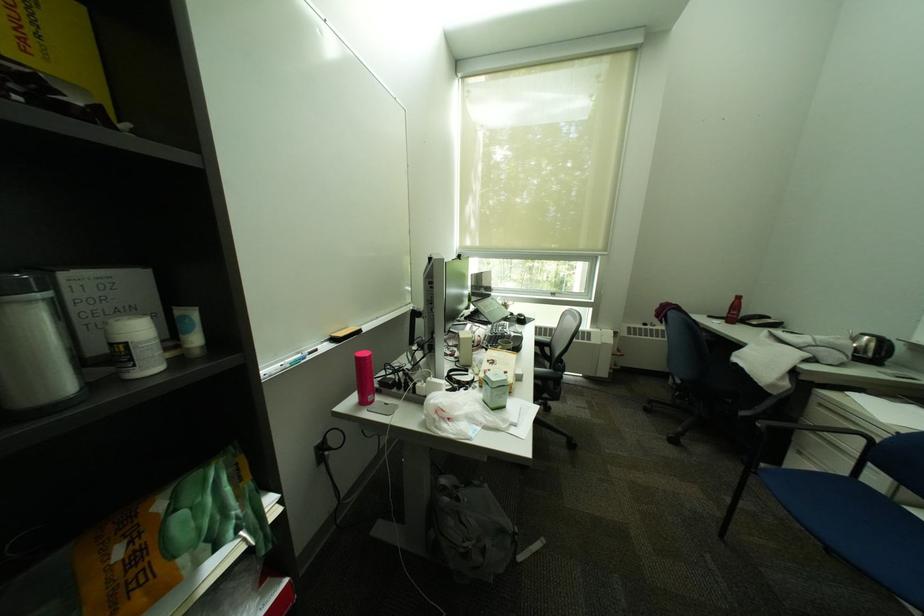
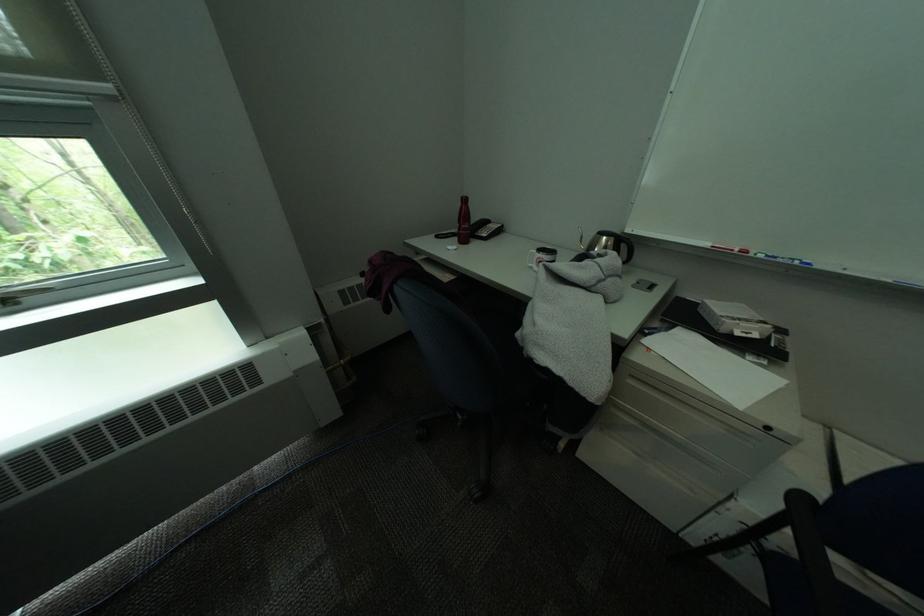
Where in the second image is the point corresponding to pixel 830 345 from the first image?

(615, 274)